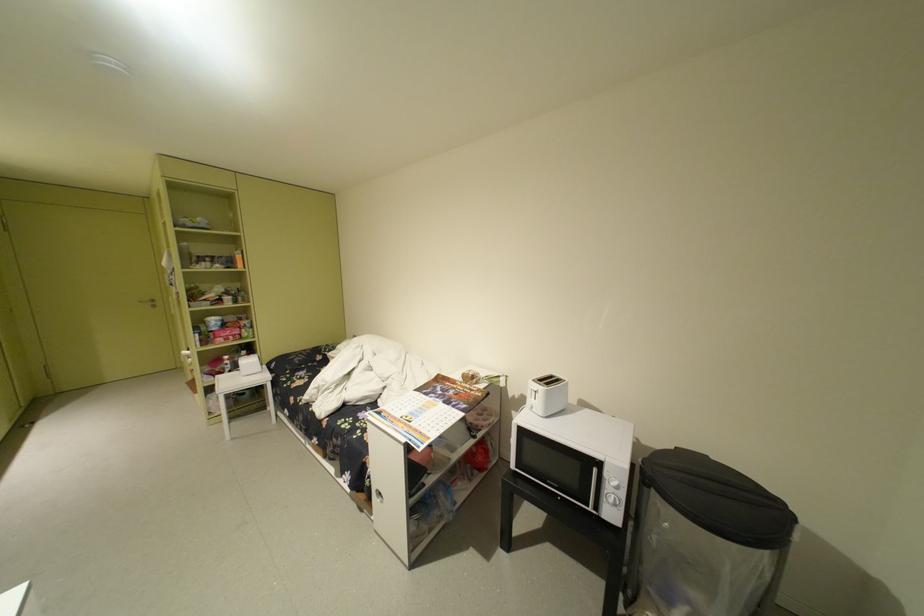
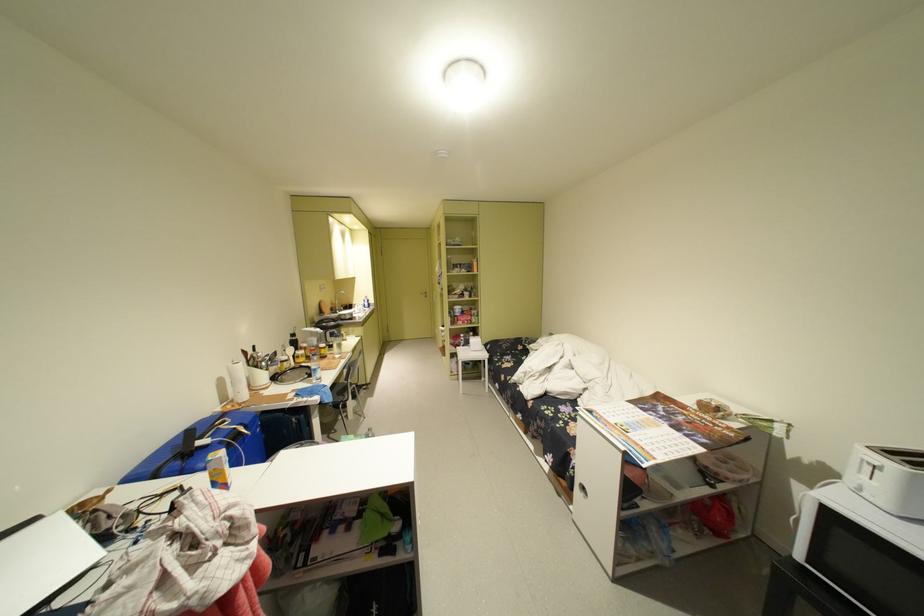
Question: Based on the continuous images, in which direction is the camera rotating? Reply with the corresponding letter.

Choices:
 (A) Left
 (B) Right
 (C) Up
 (D) Down

Answer: (A)